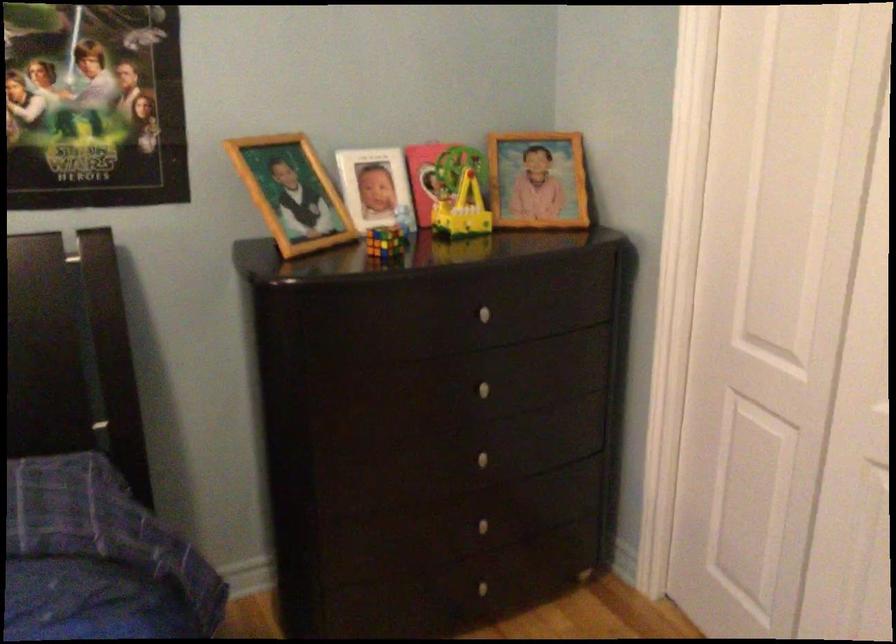
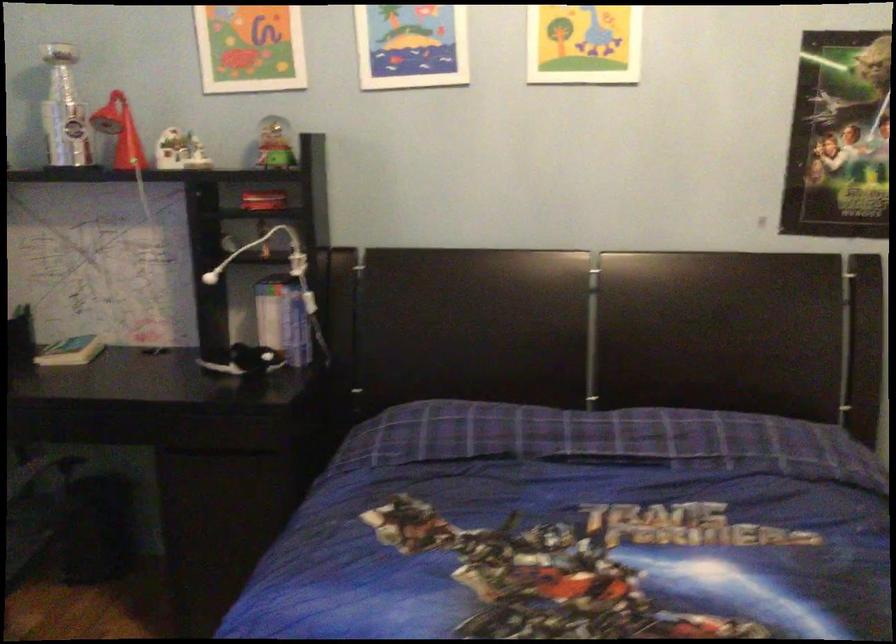
Question: Based on the continuous images, in which direction is the camera rotating? Reply with the corresponding letter.

Choices:
 (A) Left
 (B) Right
 (C) Up
 (D) Down

Answer: (A)